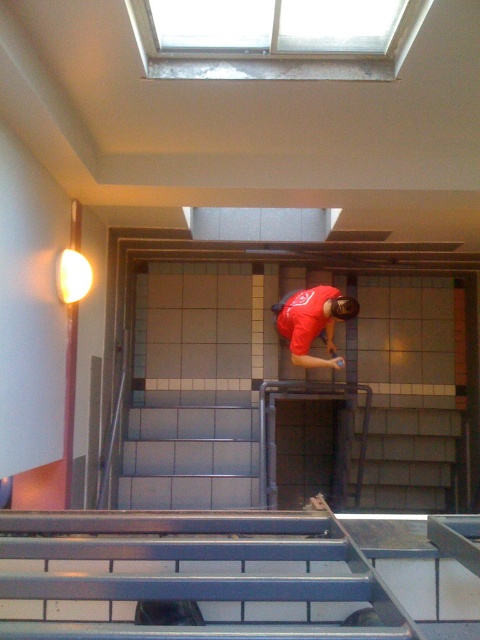
Question: Among these objects, which one is nearest to the camera?

Choices:
 (A) matte red shirt at center
 (B) metallic gray stairs at center

Answer: (B)

Question: Which point appears closest to the camera in this image?

Choices:
 (A) (216, 396)
 (B) (339, 298)

Answer: (B)

Question: Is metallic gray stairs at center above matte red shirt at center?

Choices:
 (A) yes
 (B) no

Answer: (B)

Question: Can you confirm if metallic gray stairs at center is smaller than matte red shirt at center?

Choices:
 (A) yes
 (B) no

Answer: (B)

Question: Does metallic gray stairs at center appear on the left side of matte red shirt at center?

Choices:
 (A) yes
 (B) no

Answer: (A)